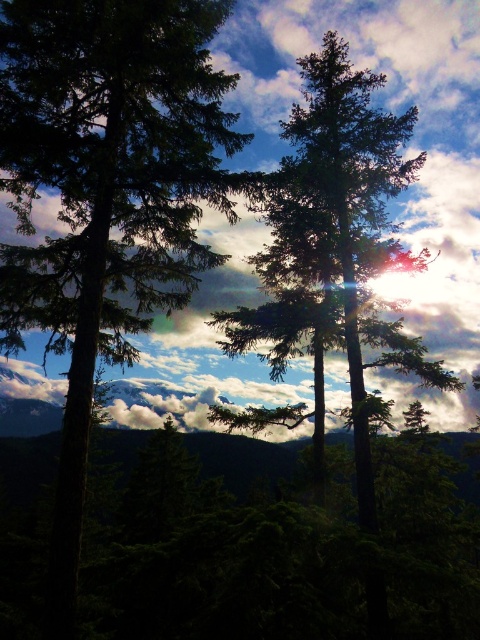
At what (x,y) coordinates should I click in order to perform the action: click on dark green textured tree at left. Please return your answer as a coordinate pair (x, y). The height and width of the screenshot is (640, 480). Looking at the image, I should click on (106, 195).

The width and height of the screenshot is (480, 640). What do you see at coordinates (106, 195) in the screenshot?
I see `dark green textured tree at left` at bounding box center [106, 195].

Locate an element on the screen. dark green textured tree at left is located at coordinates (106, 195).

Between dark green textured tree at left and green matte tree at center, which one has more height?

green matte tree at center

From the picture: Does dark green textured tree at left appear under green matte tree at center?

Yes, dark green textured tree at left is below green matte tree at center.

Is point (148, 29) farther from viewer compared to point (375, 257)?

No, it is in front of (375, 257).

Image resolution: width=480 pixels, height=640 pixels. Identify the location of dark green textured tree at left. (106, 195).

Locate an element on the screen. The height and width of the screenshot is (640, 480). green matte trees at center is located at coordinates click(x=218, y=557).

Which is below, green matte trees at center or green matte tree at center?

green matte trees at center is lower down.

Who is more forward, (x=186, y=586) or (x=361, y=216)?

Positioned in front is point (x=186, y=586).

This screenshot has width=480, height=640. In order to click on green matte trees at center in this screenshot , I will do 218,557.